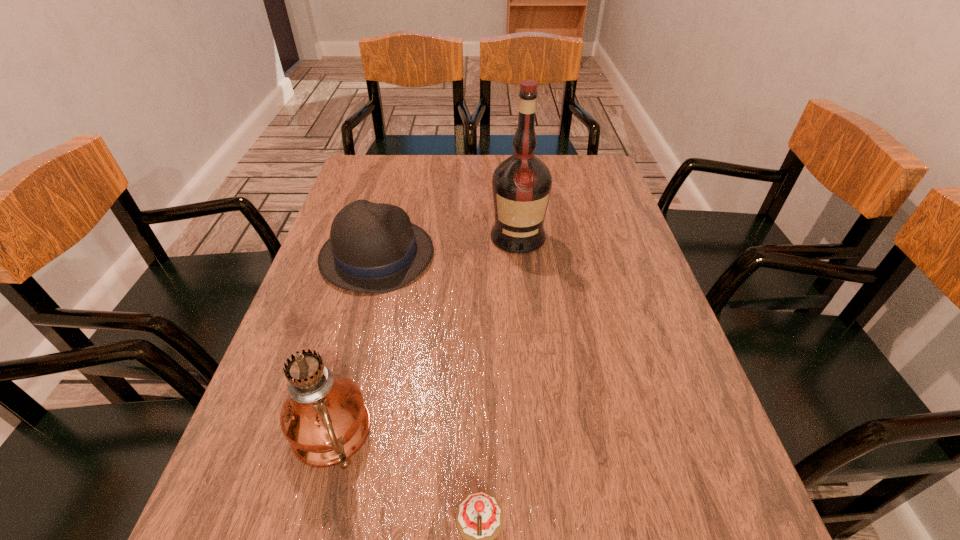
Identify the location of free point at the left edge. (310, 291).

You are a GUI agent. You are given a task and a screenshot of the screen. Output one action in this format:
    pyautogui.click(x=<x>, y=<y>)
    Task: Click on the vacant space at the right edge of the desktop
    The image size is (960, 540).
    Given the screenshot: What is the action you would take?
    pyautogui.click(x=601, y=269)

The width and height of the screenshot is (960, 540). I want to click on vacant region at the far left corner, so click(x=354, y=183).

The image size is (960, 540). In order to click on blank space at the far right corner in this screenshot , I will do `click(610, 185)`.

The height and width of the screenshot is (540, 960). I want to click on vacant region between the bowler hat and the third farthest object, so click(353, 346).

Identify the location of vacant space that is in between the third farthest object and the liquor. (423, 336).

Image resolution: width=960 pixels, height=540 pixels. I want to click on unoccupied area between the liquor and the third tallest object, so click(447, 246).

Where is `free spot between the liquor and the oil lamp`? The width and height of the screenshot is (960, 540). free spot between the liquor and the oil lamp is located at coordinates (423, 336).

Where is `vacant space that's between the third tallest object and the oil lamp`? The width and height of the screenshot is (960, 540). vacant space that's between the third tallest object and the oil lamp is located at coordinates (353, 346).

Locate an element on the screen. the third closest object to the second nearest object is located at coordinates (521, 185).